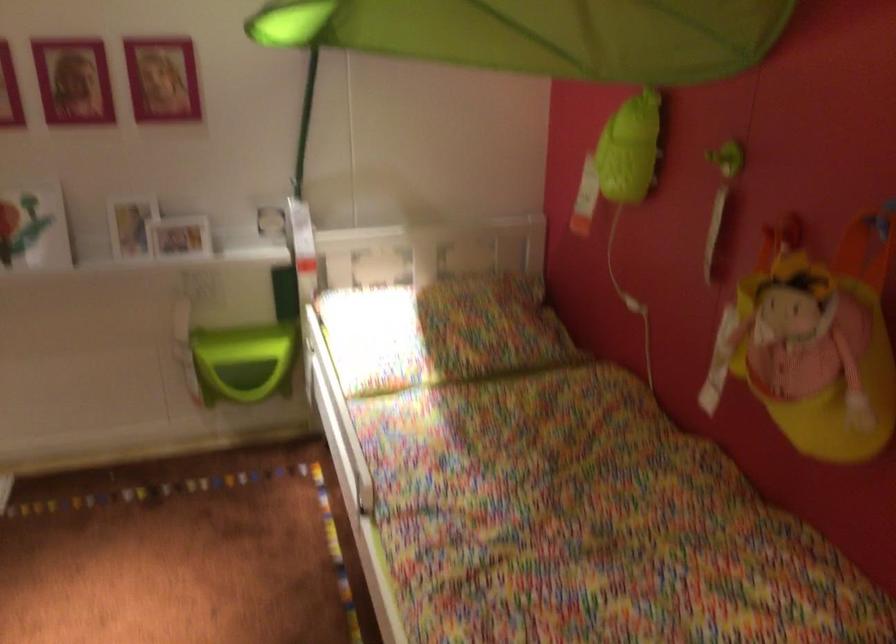
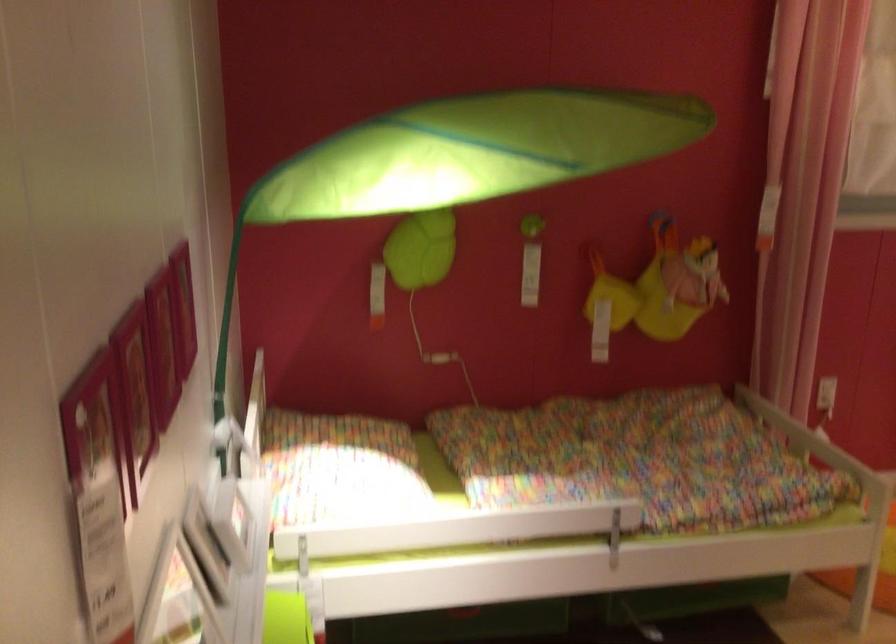
In the second image, find the point that corresponds to point (400, 303) in the first image.

(339, 468)